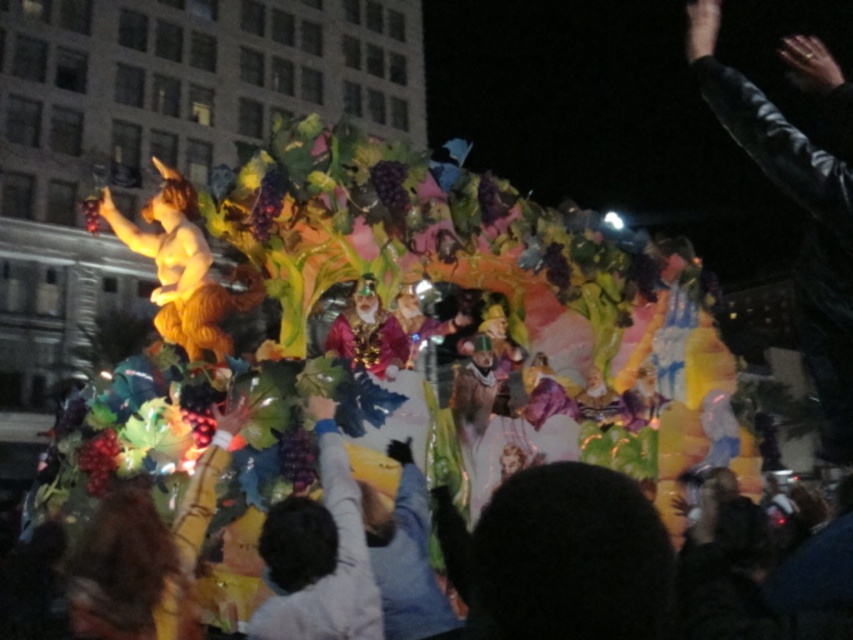
You are a photographer trying to capture the smooth purple grapes at center in your shot. However, the black leather jacket at upper right is blocking your view. Can you move to a position where you can see both objects without obstruction?

The smooth purple grapes at center is behind the black leather jacket at upper right, so moving to a position where you can see both might require positioning yourself in a way that allows you to see around or over the jacket. However, since the grapes are behind the jacket, it may not be possible to see both simultaneously without adjusting the angle or moving the jacket.

You are a photographer trying to capture both the black leather jacket at upper right and the smooth purple grapes at center in a single shot. Based on their sizes in the image, which object should you focus on first to ensure both are in frame?

The black leather jacket at upper right is much taller than the smooth purple grapes at center, so focusing on the larger object first will help frame both effectively.

You are a photographer trying to capture the entire float in one shot. You notice two points on the float marked as point 1 at position (734, 125) and point 2 at position (329, 584). Which point is closer to your camera lens?

Point 1 at position (734, 125) is closer to the camera lens than point 2 at position (329, 584) because it is further to the camera according to the description.